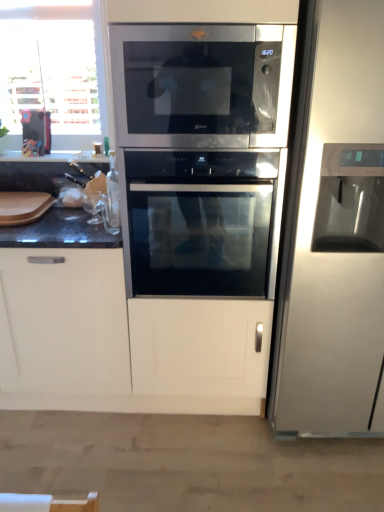
Question: Does satin silver refrigerator at right lie behind stainless steel microwave at center?

Choices:
 (A) no
 (B) yes

Answer: (A)

Question: Is satin silver refrigerator at right aimed at stainless steel microwave at center?

Choices:
 (A) no
 (B) yes

Answer: (A)

Question: Is stainless steel microwave at center a part of satin silver refrigerator at right?

Choices:
 (A) no
 (B) yes

Answer: (A)

Question: Is satin silver refrigerator at right wider than stainless steel microwave at center?

Choices:
 (A) yes
 (B) no

Answer: (A)

Question: From the image's perspective, is satin silver refrigerator at right on top of stainless steel microwave at center?

Choices:
 (A) yes
 (B) no

Answer: (B)

Question: Considering the positions of satin black oven at center and satin silver refrigerator at right in the image, is satin black oven at center taller or shorter than satin silver refrigerator at right?

Choices:
 (A) short
 (B) tall

Answer: (A)

Question: From the image's perspective, relative to satin silver refrigerator at right, is satin black oven at center above or below?

Choices:
 (A) below
 (B) above

Answer: (A)

Question: From a real-world perspective, relative to satin silver refrigerator at right, is satin black oven at center vertically above or below?

Choices:
 (A) above
 (B) below

Answer: (B)

Question: Visually, is satin black oven at center positioned to the left or to the right of satin silver refrigerator at right?

Choices:
 (A) left
 (B) right

Answer: (A)

Question: Based on their sizes in the image, would you say stainless steel microwave at center is bigger or smaller than satin black oven at center?

Choices:
 (A) small
 (B) big

Answer: (A)

Question: From the image's perspective, relative to satin black oven at center, is stainless steel microwave at center above or below?

Choices:
 (A) above
 (B) below

Answer: (A)

Question: Is point (205, 30) closer or farther from the camera than point (160, 157)?

Choices:
 (A) closer
 (B) farther

Answer: (A)

Question: Is stainless steel microwave at center in front of or behind satin black oven at center in the image?

Choices:
 (A) behind
 (B) front

Answer: (B)

Question: Does point (269, 408) appear closer or farther from the camera than point (132, 74)?

Choices:
 (A) farther
 (B) closer

Answer: (A)

Question: Considering the relative positions of satin silver refrigerator at right and stainless steel microwave at center in the image provided, is satin silver refrigerator at right to the left or to the right of stainless steel microwave at center?

Choices:
 (A) left
 (B) right

Answer: (B)